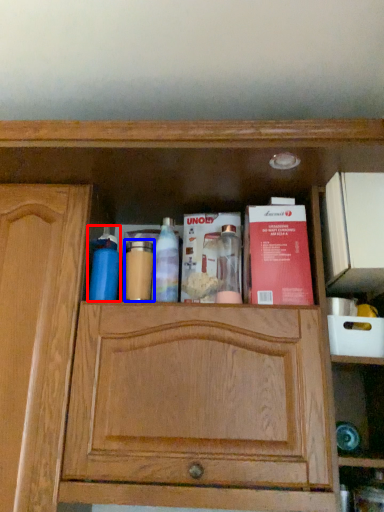
Question: Which object appears farthest to the camera in this image, cleaning product (highlighted by a red box) or toiletry (highlighted by a blue box)?

Choices:
 (A) cleaning product
 (B) toiletry

Answer: (B)